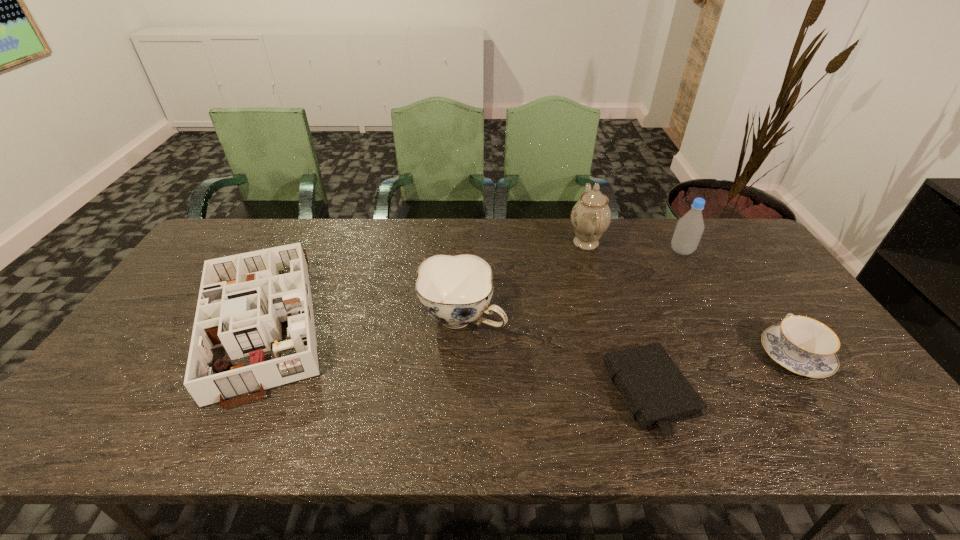
Identify the location of free space at the left edge of the desktop. (144, 323).

Find the location of a particular element. vacant region at the right edge of the desktop is located at coordinates (859, 392).

Identify the location of vacant space that's between the leftmost object and the Bible. This screenshot has height=540, width=960. [x=457, y=357].

I want to click on vacant space in between the fourth shortest object and the fifth object from left to right, so click(572, 285).

The width and height of the screenshot is (960, 540). Find the location of `free space between the Bible and the leftmost object`. free space between the Bible and the leftmost object is located at coordinates (457, 357).

Locate an element on the screen. This screenshot has height=540, width=960. free space that is in between the bottle and the second tallest chinaware is located at coordinates (572, 285).

Find the location of a particular element. free space between the rightmost chinaware and the dollhouse is located at coordinates (529, 338).

Locate an element on the screen. The image size is (960, 540). free point between the rightmost object and the second tallest chinaware is located at coordinates (628, 336).

In order to click on empty location between the second tallest chinaware and the dollhouse in this screenshot , I will do `click(363, 319)`.

I want to click on free space between the fifth object from left to right and the second chinaware from right to left, so click(634, 247).